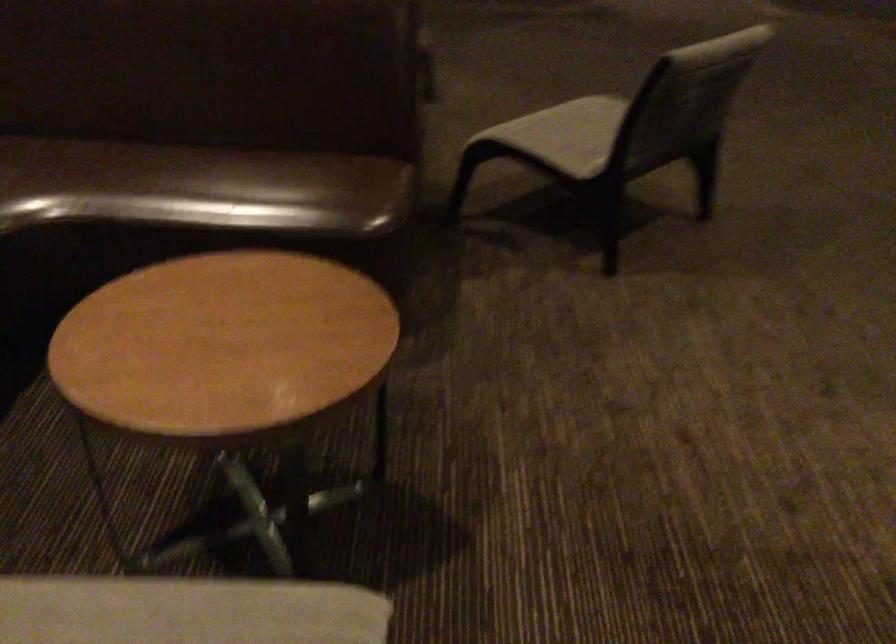
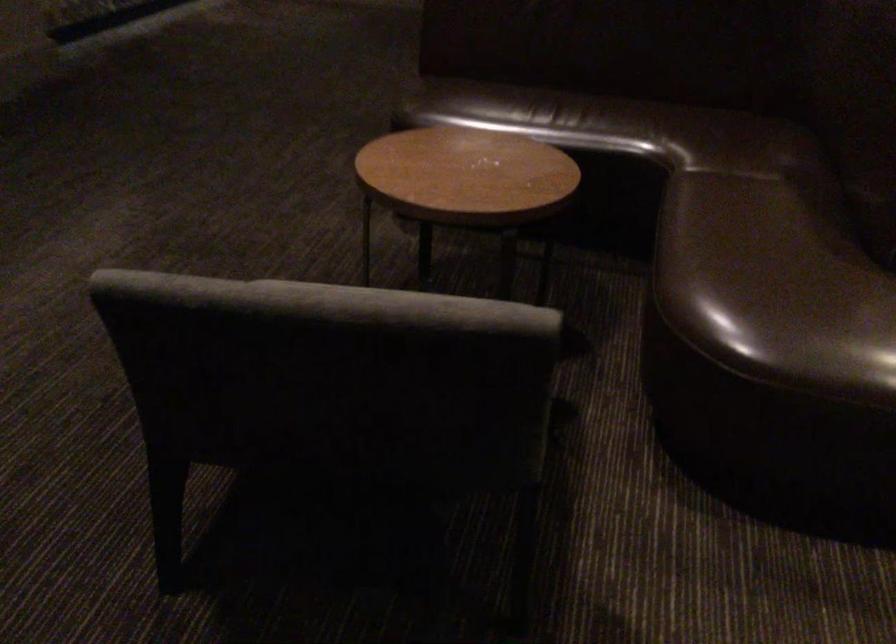
Question: What movement of the cameraman would produce the second image?

Choices:
 (A) Left
 (B) Right
 (C) Forward
 (D) Backward

Answer: (A)